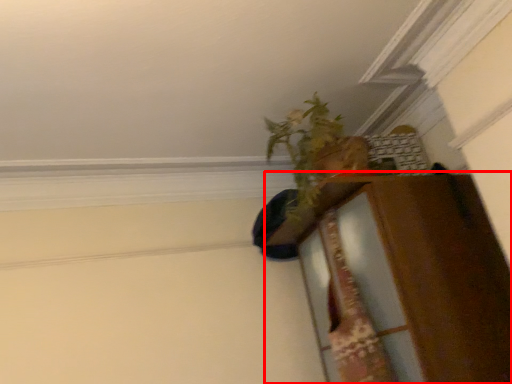
Question: From the image's perspective, where is dresser (annotated by the red box) located in relation to houseplant in the image?

Choices:
 (A) above
 (B) below

Answer: (B)